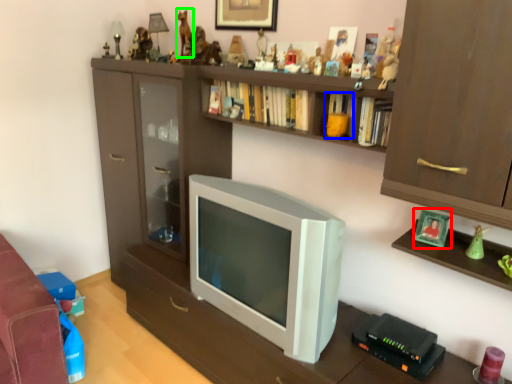
Question: Which object is positioned closest to picture frame (highlighted by a red box)? Select from book (highlighted by a blue box) and toy (highlighted by a green box).

Choices:
 (A) book
 (B) toy

Answer: (A)